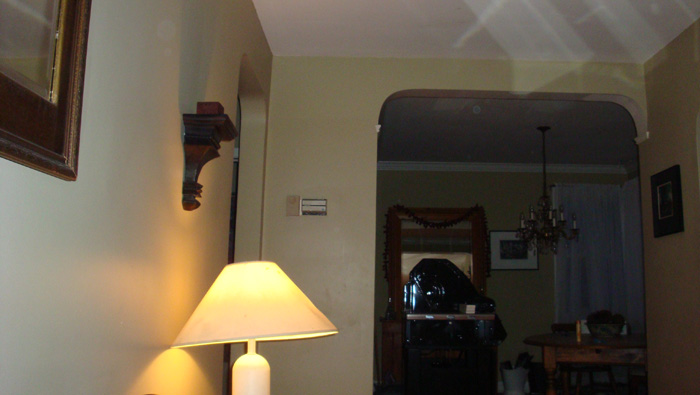
The image size is (700, 395). I want to click on hallway, so coord(244,213).